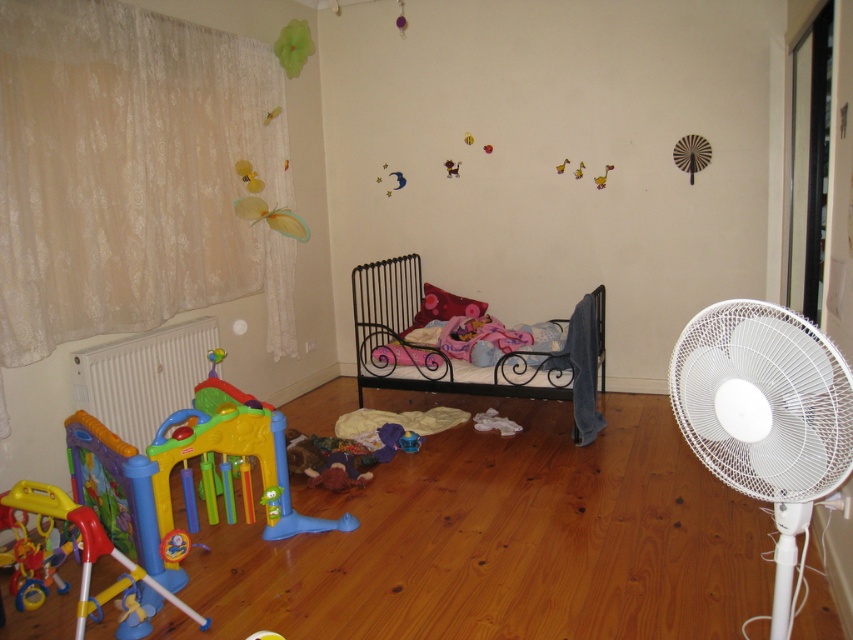
You are standing in the center of the child bedroom and looking at two points marked in the image. The first point is at coordinates point (x=747, y=365) and the second is at point (x=91, y=352). Which point is closer to your current position?

Point (x=747, y=365) is closer to the camera than point (x=91, y=352), so the first point is closer to your current position.

You are a parent trying to place a new toy on the floor near the multicolored plastic playpen at lower left and the white plastic radiator at lower left. However, you want to avoid placing it too close to the radiator to prevent overheating. Based on their positions, which object should you place the toy closer to?

You should place the toy closer to the multicolored plastic playpen at lower left because it is positioned under the white plastic radiator at lower left, meaning the radiator is above it. This placement ensures the toy stays away from the radiator and avoids overheating.

You are a parent standing at the camera position in the child bedroom. You want to turn on the white plastic fan at right but you can only reach up to 3 feet. Can you reach it?

The white plastic fan at right is 3.84 feet from camera, so you cannot reach it since your maximum reach is 3 feet.